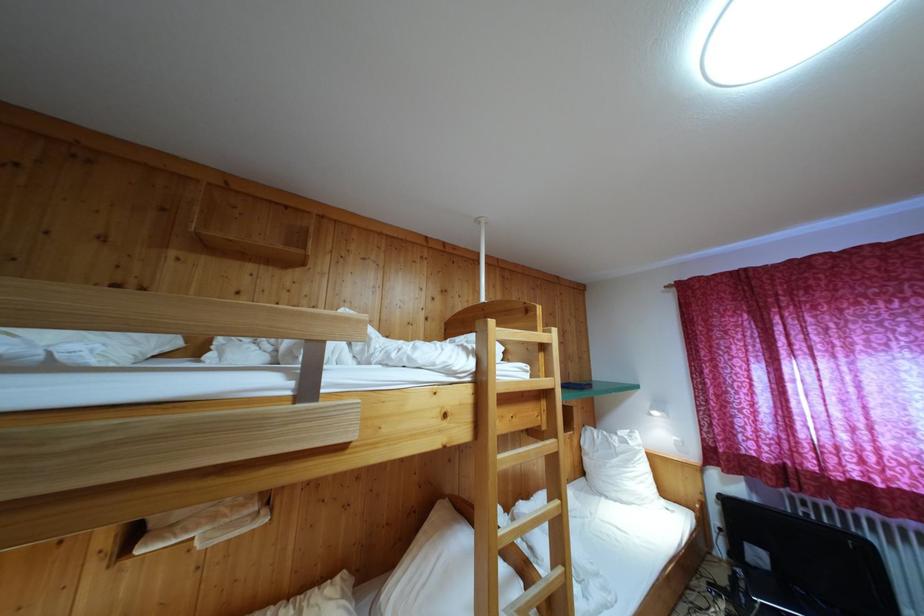
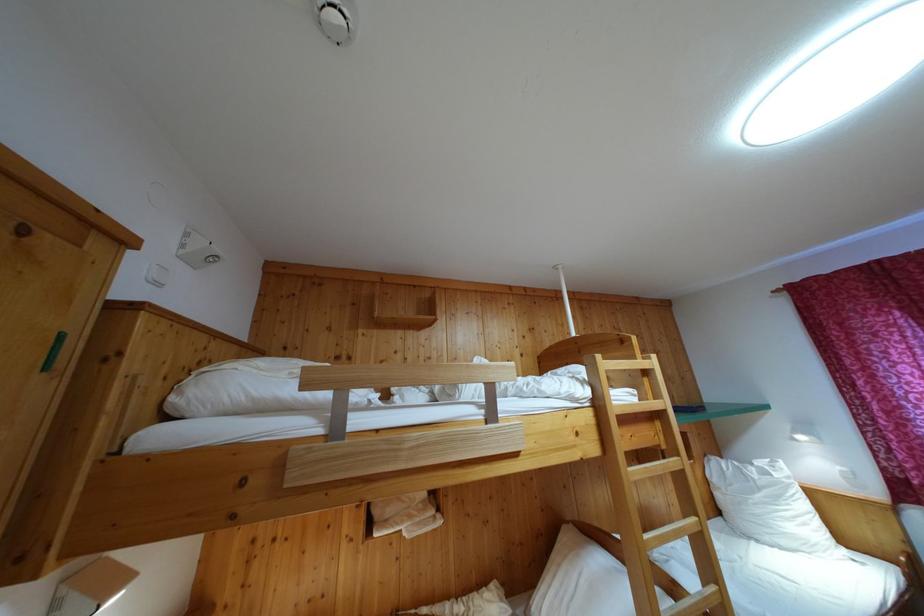
Find the pixel in the second image that matches (x=555, y=398) in the first image.

(669, 418)